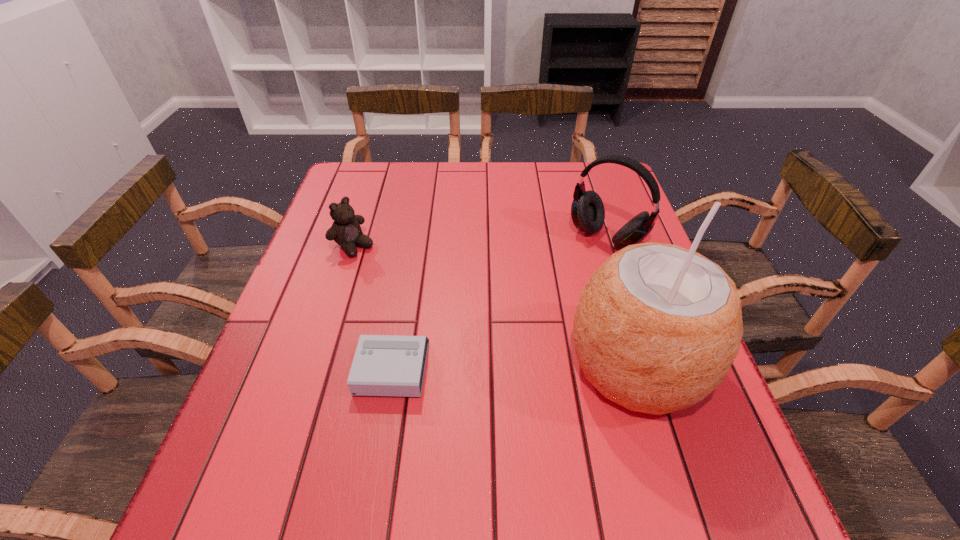
This screenshot has width=960, height=540. In order to click on vacant space on the desktop that is between the second object from left to right and the coconut and is positioned on the ear cups of the headset in this screenshot , I will do `click(487, 367)`.

Locate an element on the screen. The height and width of the screenshot is (540, 960). vacant space on the desktop that is between the shortest object and the tallest object and is positioned on the face of the teddy bear is located at coordinates (519, 366).